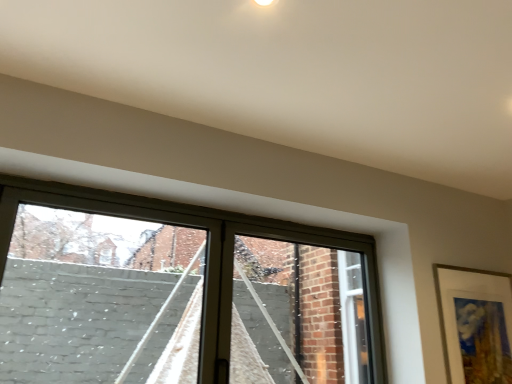
Question: Visually, is matte white picture frame at right positioned to the left or to the right of clear glass window at center?

Choices:
 (A) right
 (B) left

Answer: (A)

Question: From the image's perspective, is matte white picture frame at right above or below clear glass window at center?

Choices:
 (A) above
 (B) below

Answer: (B)

Question: Considering the positions of matte white picture frame at right and clear glass window at center in the image, is matte white picture frame at right wider or thinner than clear glass window at center?

Choices:
 (A) thin
 (B) wide

Answer: (A)

Question: Is point (295, 231) positioned closer to the camera than point (436, 291)?

Choices:
 (A) farther
 (B) closer

Answer: (A)

Question: Visually, is clear glass window at center positioned to the left or to the right of matte white picture frame at right?

Choices:
 (A) right
 (B) left

Answer: (B)

Question: Is clear glass window at center taller or shorter than matte white picture frame at right?

Choices:
 (A) tall
 (B) short

Answer: (A)

Question: Looking at the image, does clear glass window at center seem bigger or smaller compared to matte white picture frame at right?

Choices:
 (A) small
 (B) big

Answer: (B)